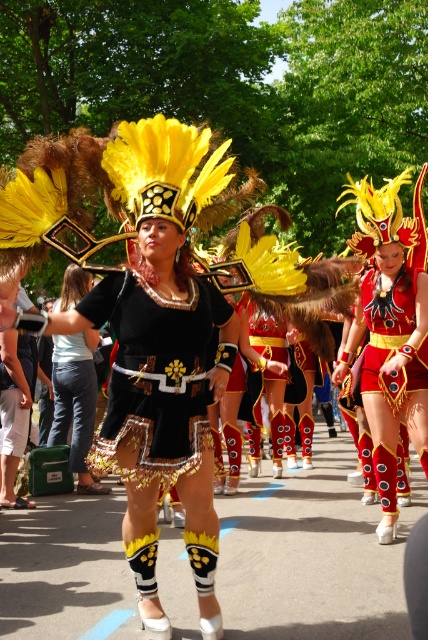
Is black matte fabric skirt at center wider than matte black dress at center?

No, black matte fabric skirt at center is not wider than matte black dress at center.

Does black matte fabric skirt at center appear under matte black dress at center?

Incorrect, black matte fabric skirt at center is not positioned below matte black dress at center.

Locate an element on the screen. This screenshot has height=640, width=428. black matte fabric skirt at center is located at coordinates (154, 376).

Locate an element on the screen. black matte fabric skirt at center is located at coordinates (154, 376).

Is point (184, 413) more distant than point (374, 214)?

No, (184, 413) is in front of (374, 214).

Is point (136, 328) positioned in front of point (369, 214)?

Yes, it is in front of point (369, 214).

Is point (145, 404) in front of point (374, 456)?

Yes, it is in front of point (374, 456).

This screenshot has width=428, height=640. Identify the location of black matte fabric skirt at center. (154, 376).

Between shiny red fabric dress at center and matte black dress at center, which one appears on the left side from the viewer's perspective?

Positioned to the left is matte black dress at center.

Is shiny red fabric dress at center to the left of matte black dress at center from the viewer's perspective?

In fact, shiny red fabric dress at center is to the right of matte black dress at center.

Which is behind, point (389, 355) or point (67, 278)?

The point (67, 278) is behind.

Find the location of a particular element. shiny red fabric dress at center is located at coordinates (389, 333).